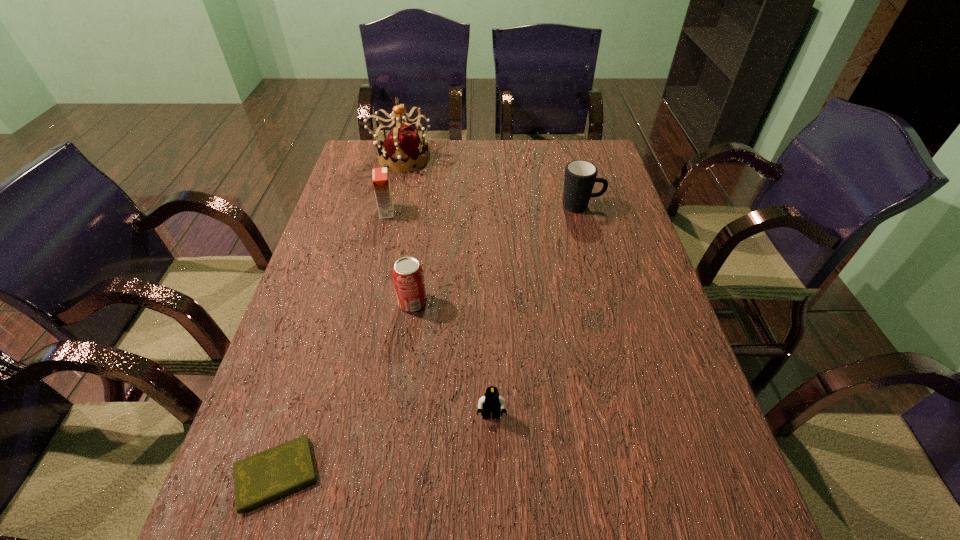
Where is `vacant space located on the side of the rightmost object with the handle`? The width and height of the screenshot is (960, 540). vacant space located on the side of the rightmost object with the handle is located at coordinates (626, 206).

The height and width of the screenshot is (540, 960). In order to click on vacant space situated on the back of the orange juice in this screenshot , I will do `click(397, 167)`.

Where is `vacant space located on the right of the soda can`? vacant space located on the right of the soda can is located at coordinates (585, 302).

Locate an element on the screen. free location located on the front-facing side of the fifth object from left to right is located at coordinates (492, 471).

Locate an element on the screen. The width and height of the screenshot is (960, 540). free location located 0.320m on the right of the nearest object is located at coordinates (495, 475).

Identify the location of object at the far edge. [402, 145].

You are a GUI agent. You are given a task and a screenshot of the screen. Output one action in this format:
    pyautogui.click(x=<x>, y=<y>)
    Task: Click on the tiara that is positioned at the left edge
    The height and width of the screenshot is (540, 960).
    Given the screenshot: What is the action you would take?
    pyautogui.click(x=402, y=145)

Where is `orange juice that is at the left edge`? This screenshot has width=960, height=540. orange juice that is at the left edge is located at coordinates (381, 183).

Find the location of a particular element. The image size is (960, 540). diary positioned at the left edge is located at coordinates tap(272, 473).

The height and width of the screenshot is (540, 960). Identify the location of object located in the right edge section of the desktop. (580, 176).